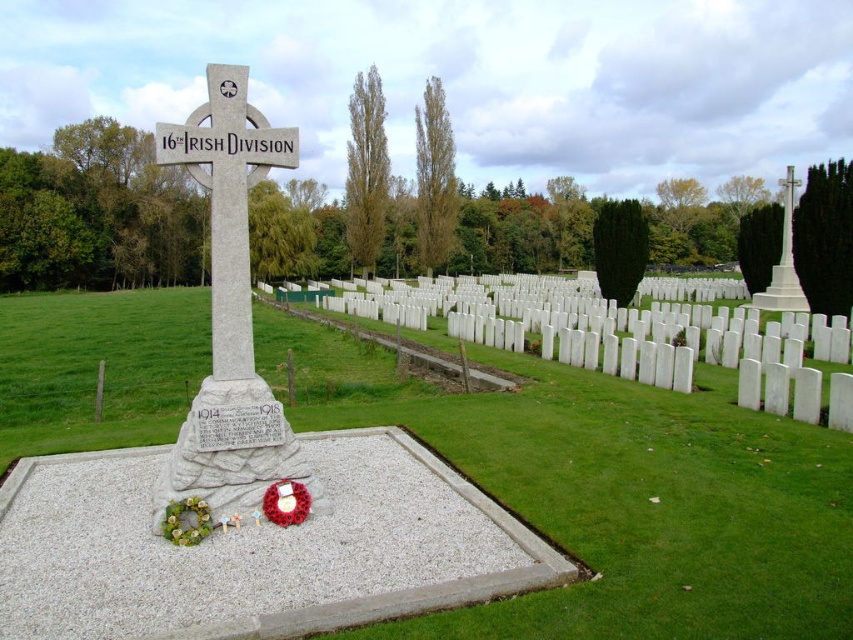
You are a tourist visiting the war memorial and want to take a photo of both the gray stone cross at center and the white stone cross at upper right. Which cross should you stand closer to in order to capture both in your camera frame?

Since the gray stone cross at center is not as tall as the white stone cross at upper right, you should stand closer to the gray stone cross at center to ensure both are visible in the frame.

From the picture: You are standing at the center of the war memorial and want to place a new wreath exactly where the white floral wreath at lower left was placed. What are the coordinates of the spot where you should place your new wreath?

The coordinates for the white floral wreath at lower left are at point [186,522].

You are a tourist visiting the war memorial and want to take a photo of both the gray stone cross at center and the white stone cross at upper right. Which cross should you position closer to the camera to ensure both are in the frame?

You should position the gray stone cross at center closer to the camera since it is in front of the white stone cross at upper right, ensuring both are visible in the photo.